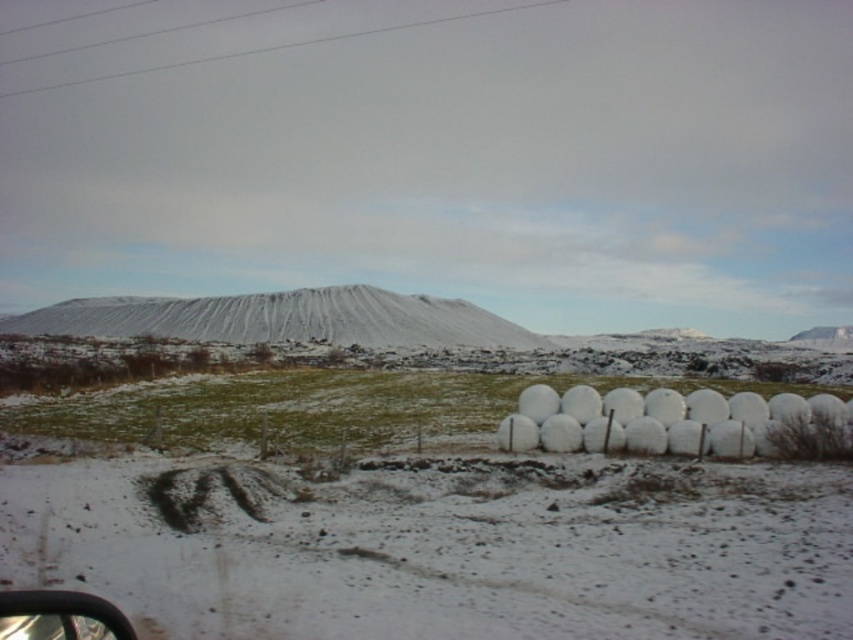
Does white snow-covered mountain at center have a smaller size compared to transparent glass car window at lower left?

No, white snow-covered mountain at center is not smaller than transparent glass car window at lower left.

Is point (486, 330) behind point (21, 595)?

Yes.

Where is `white snow-covered mountain at center`? This screenshot has width=853, height=640. white snow-covered mountain at center is located at coordinates (283, 320).